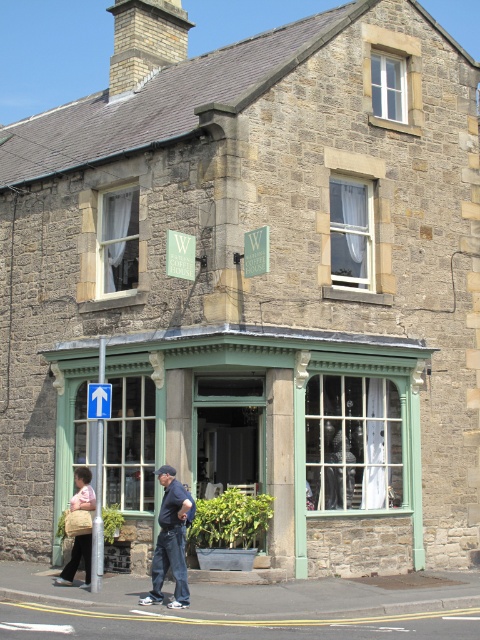
Question: In this image, where is dark blue jeans at lower center located relative to blue plastic arrow at upper left?

Choices:
 (A) below
 (B) above

Answer: (A)

Question: Which object appears farthest from the camera in this image?

Choices:
 (A) matte beige handbag at lower left
 (B) gray asphalt at lower center
 (C) green glass storefront at lower left

Answer: (C)

Question: Is gray asphalt at lower center thinner than dark blue jeans at lower center?

Choices:
 (A) no
 (B) yes

Answer: (A)

Question: Does green glass storefront at lower left appear under blue plastic arrow at upper left?

Choices:
 (A) yes
 (B) no

Answer: (A)

Question: Considering the real-world distances, which object is closest to the green glass storefront at lower left?

Choices:
 (A) dark blue jeans at lower center
 (B) beige woven bag at lower left

Answer: (A)

Question: Estimate the real-world distances between objects in this image. Which object is closer to the blue plastic arrow at upper left?

Choices:
 (A) beige woven bag at lower left
 (B) green glass storefront at lower left
 (C) matte beige handbag at lower left

Answer: (C)